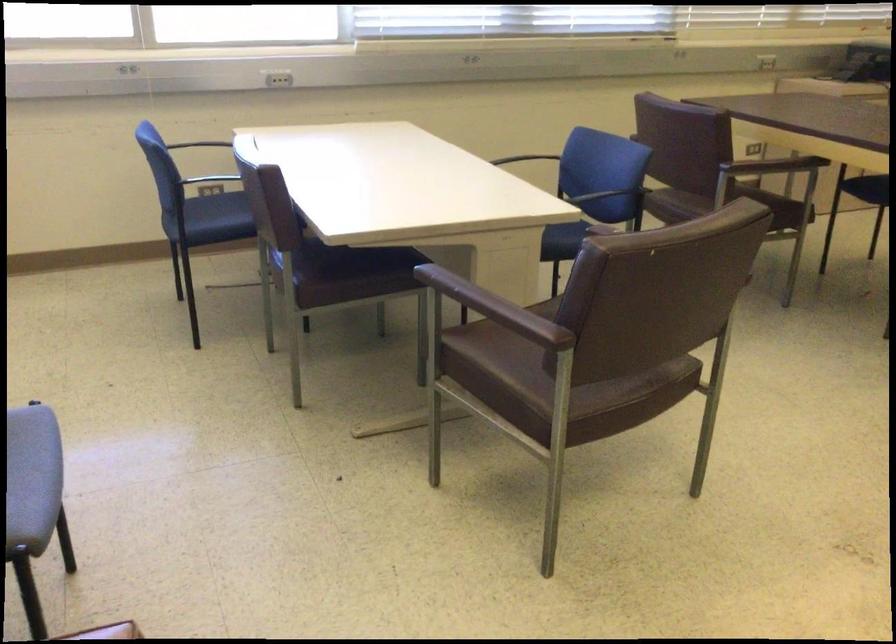
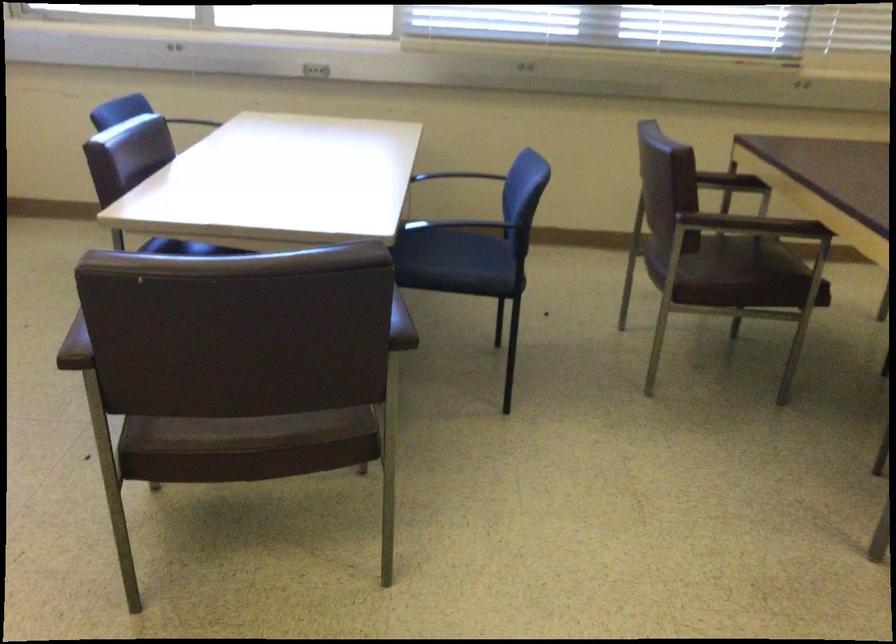
Question: I am providing you with two images of the same scene from different viewpoints. Please identify which objects are invisible in image2.

Choices:
 (A) blue chair sitting surface
 (B) blue desk globe
 (C) brown chair armrest
 (D) metal chair armrest

Answer: (C)